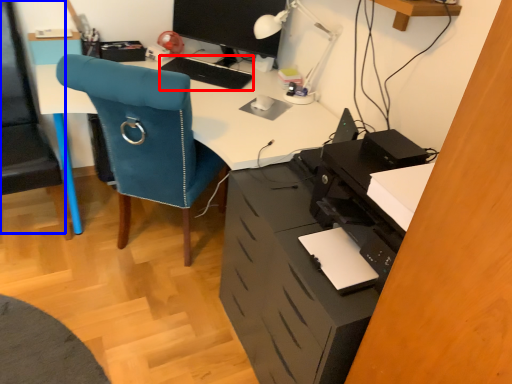
Question: Which of the following is the farthest to the observer, keyboard (highlighted by a red box) or computer chair (highlighted by a blue box)?

Choices:
 (A) keyboard
 (B) computer chair

Answer: (A)